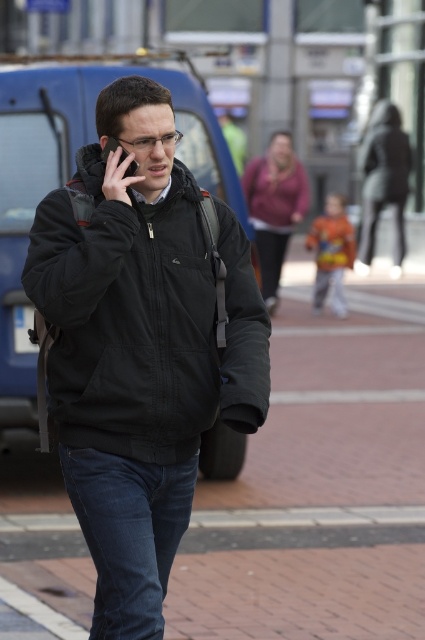
You are a pedestrian standing on the busy urban street scene. You notice the dark blue denim jeans at lower center and the black matte smartphone at upper left. Which object is taller?

The dark blue denim jeans at lower center is taller than the black matte smartphone at upper left.

You are a fashion designer observing the urban street scene. You notice the dark blue denim jeans at lower center and the black matte smartphone at upper left. Which item has a greater width?

The dark blue denim jeans at lower center has a greater width than the black matte smartphone at upper left.

You are standing at the point closer to the camera in this urban scene. Which point are you at, point (252, 353) or point (107, 138)?

You are at point (252, 353) because it is further to the camera than point (107, 138).